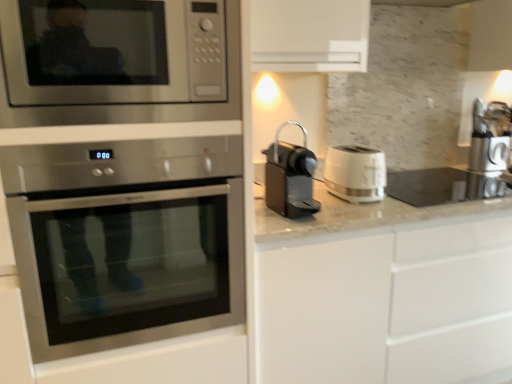
Question: From their relative heights in the image, would you say stainless steel oven at left is taller or shorter than stainless steel microwave at upper left?

Choices:
 (A) short
 (B) tall

Answer: (B)

Question: From a real-world perspective, is stainless steel oven at left physically located above or below stainless steel microwave at upper left?

Choices:
 (A) above
 (B) below

Answer: (B)

Question: Which is nearer to the white glossy cabinet at center?

Choices:
 (A) stainless steel microwave at upper left
 (B) satin silver coffee machine at right, placed as the 1th coffee machine when sorted from back to front
 (C) white marble countertop at right
 (D) stainless steel oven at left
 (E) white plastic toaster at right

Answer: (C)

Question: Estimate the real-world distances between objects in this image. Which object is closer to the stainless steel microwave at upper left?

Choices:
 (A) white marble countertop at right
 (B) satin silver coffee machine at right, the 1th coffee machine viewed from the right
 (C) stainless steel oven at left
 (D) black plastic coffee machine at center, the first coffee machine from the front
 (E) white glossy cabinet at center

Answer: (C)